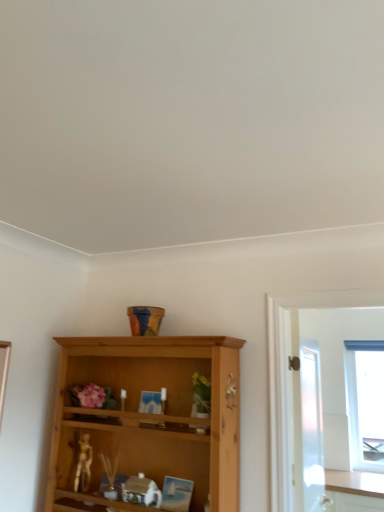
Question: From the image's perspective, is metallic gold figurine at lower left positioned above or below white frosted glass screen door at right?

Choices:
 (A) above
 (B) below

Answer: (B)

Question: In the image, is metallic gold figurine at lower left on the left side or the right side of white frosted glass screen door at right?

Choices:
 (A) left
 (B) right

Answer: (A)

Question: Which object is positioned farthest from the metallic gold figurine at lower left?

Choices:
 (A) white frosted glass screen door at right
 (B) transparent glass window at right

Answer: (B)

Question: Estimate the real-world distances between objects in this image. Which object is farther from the transparent glass window at right?

Choices:
 (A) white frosted glass screen door at right
 (B) metallic gold figurine at lower left

Answer: (B)